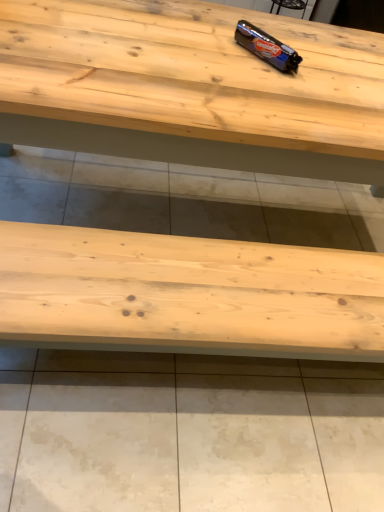
Question: Considering the relative sizes of shiny metallic chocolate bar at upper center and natural wood table at center in the image provided, is shiny metallic chocolate bar at upper center wider than natural wood table at center?

Choices:
 (A) no
 (B) yes

Answer: (A)

Question: Does shiny metallic chocolate bar at upper center have a greater height compared to natural wood table at center?

Choices:
 (A) no
 (B) yes

Answer: (A)

Question: From a real-world perspective, is shiny metallic chocolate bar at upper center positioned under natural wood table at center based on gravity?

Choices:
 (A) yes
 (B) no

Answer: (B)

Question: Is the depth of shiny metallic chocolate bar at upper center less than that of natural wood table at center?

Choices:
 (A) yes
 (B) no

Answer: (B)

Question: Considering the relative sizes of shiny metallic chocolate bar at upper center and natural wood table at center in the image provided, is shiny metallic chocolate bar at upper center shorter than natural wood table at center?

Choices:
 (A) no
 (B) yes

Answer: (B)

Question: From the image's perspective, is shiny metallic chocolate bar at upper center under natural wood table at center?

Choices:
 (A) no
 (B) yes

Answer: (A)

Question: Is the depth of natural wood table at center less than that of shiny metallic chocolate bar at upper center?

Choices:
 (A) no
 (B) yes

Answer: (B)

Question: Is natural wood table at center to the right of shiny metallic chocolate bar at upper center from the viewer's perspective?

Choices:
 (A) yes
 (B) no

Answer: (B)

Question: Can you confirm if natural wood table at center is wider than shiny metallic chocolate bar at upper center?

Choices:
 (A) no
 (B) yes

Answer: (B)

Question: Is natural wood table at center not near shiny metallic chocolate bar at upper center?

Choices:
 (A) yes
 (B) no

Answer: (B)

Question: Is shiny metallic chocolate bar at upper center surrounded by natural wood table at center?

Choices:
 (A) yes
 (B) no

Answer: (B)

Question: Could you tell me if natural wood table at center is turned towards shiny metallic chocolate bar at upper center?

Choices:
 (A) no
 (B) yes

Answer: (A)

Question: Do you think shiny metallic chocolate bar at upper center is within natural wood table at center, or outside of it?

Choices:
 (A) outside
 (B) inside

Answer: (A)